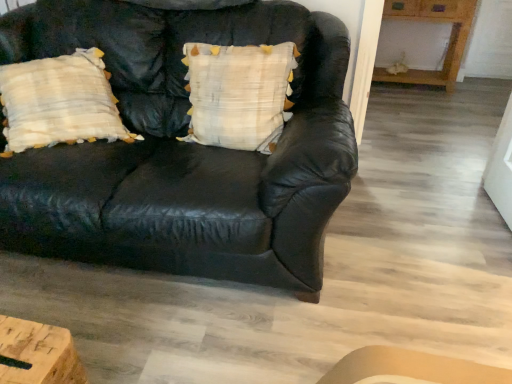
Question: From a real-world perspective, is wooden table at upper right beneath black leather couch at center?

Choices:
 (A) no
 (B) yes

Answer: (B)

Question: Is wooden table at upper right shorter than black leather couch at center?

Choices:
 (A) yes
 (B) no

Answer: (A)

Question: Does wooden table at upper right have a lesser width compared to black leather couch at center?

Choices:
 (A) no
 (B) yes

Answer: (B)

Question: Is black leather couch at center at the back of wooden table at upper right?

Choices:
 (A) no
 (B) yes

Answer: (A)

Question: Does wooden table at upper right have a smaller size compared to black leather couch at center?

Choices:
 (A) no
 (B) yes

Answer: (B)

Question: From the image's perspective, is black leather couch at center located above or below wooden table at upper right?

Choices:
 (A) below
 (B) above

Answer: (A)

Question: In the image, is black leather couch at center positioned in front of or behind wooden table at upper right?

Choices:
 (A) front
 (B) behind

Answer: (A)

Question: From a real-world perspective, is black leather couch at center above or below wooden table at upper right?

Choices:
 (A) above
 (B) below

Answer: (A)

Question: Is point (254, 225) closer or farther from the camera than point (461, 44)?

Choices:
 (A) farther
 (B) closer

Answer: (B)

Question: Based on their positions, is white textured pillow at center located to the left or right of wooden table at upper right?

Choices:
 (A) right
 (B) left

Answer: (B)

Question: In terms of width, does white textured pillow at center look wider or thinner when compared to wooden table at upper right?

Choices:
 (A) wide
 (B) thin

Answer: (B)

Question: Is white textured pillow at center taller or shorter than wooden table at upper right?

Choices:
 (A) short
 (B) tall

Answer: (A)

Question: Considering the positions of white textured pillow at center and wooden table at upper right in the image, is white textured pillow at center bigger or smaller than wooden table at upper right?

Choices:
 (A) big
 (B) small

Answer: (B)

Question: Based on their positions, is black leather couch at center located to the left or right of white textured pillow at center?

Choices:
 (A) left
 (B) right

Answer: (A)

Question: From a real-world perspective, is black leather couch at center above or below white textured pillow at center?

Choices:
 (A) above
 (B) below

Answer: (B)